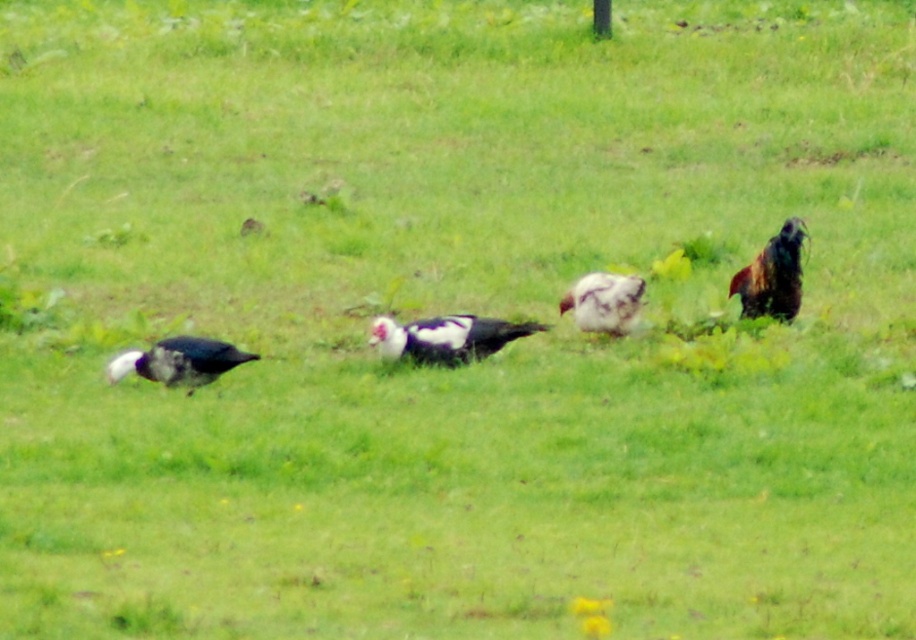
Based on the scene description, which object is located at the coordinates point (178, 362)?

The white glossy bird at left is located at point (178, 362).